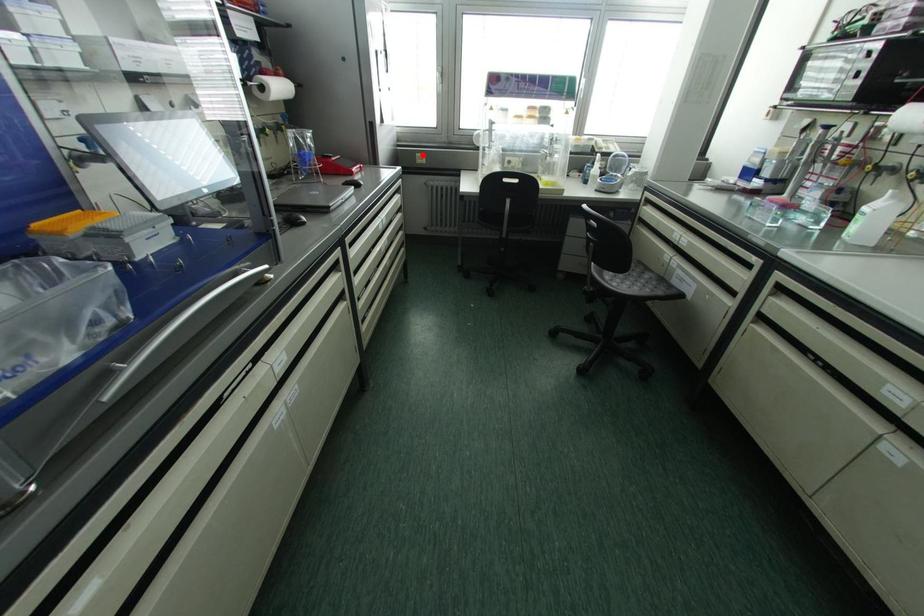
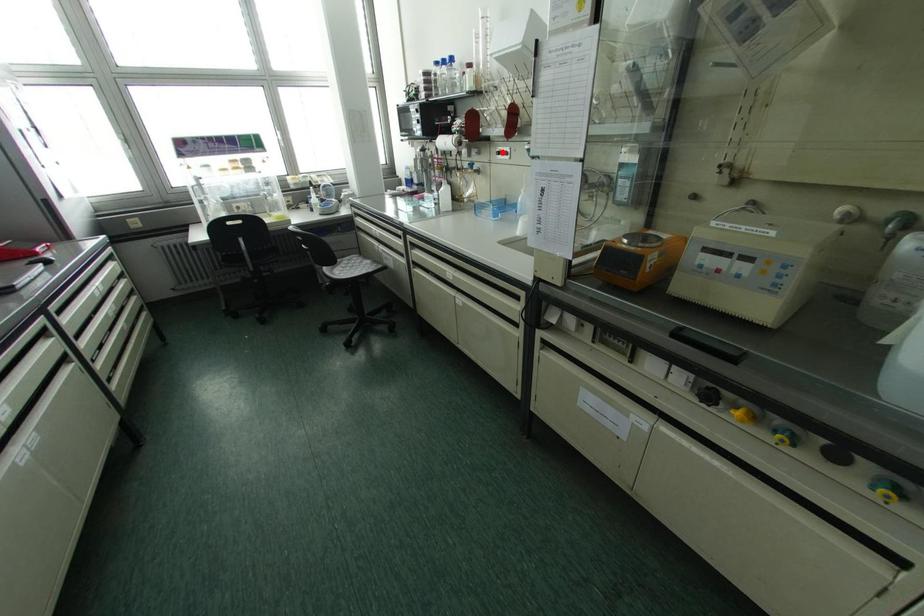
I am providing you with two images of the same scene from different viewpoints. A red point is marked on the first image and another point is marked on the second image. Is the red point in image1 aligned with the point shown in image2?

No